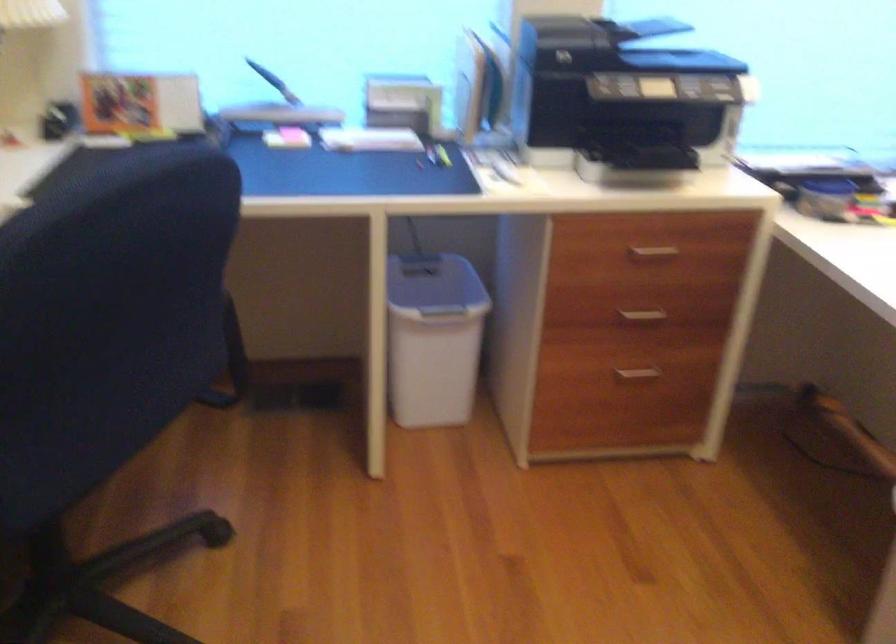
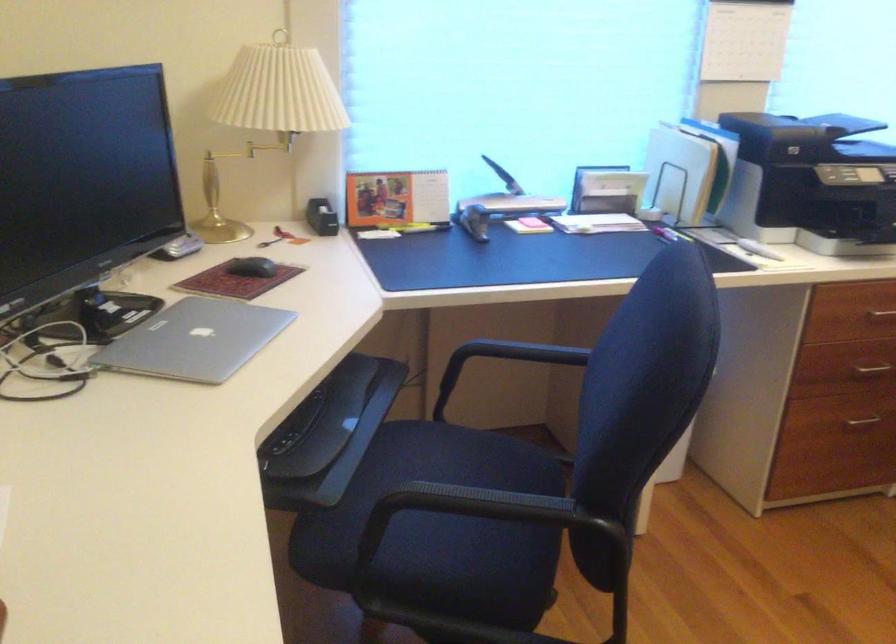
Find the pixel in the second image that matches pixel 636 375 in the first image.

(860, 422)